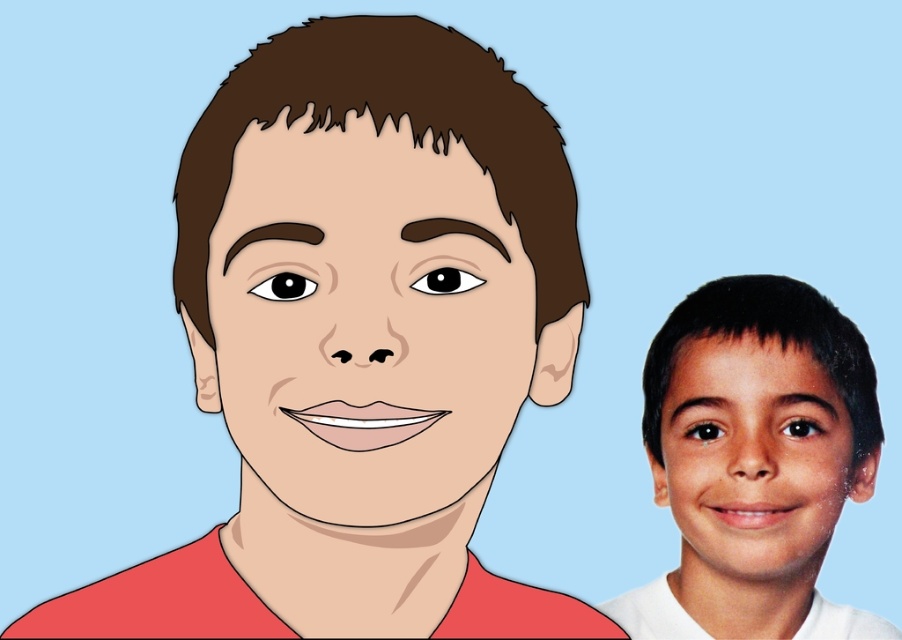
Is point (321, 234) farther from camera compared to point (728, 627)?

No.

Is smooth skin face at center to the left of smooth skin child at right from the viewer's perspective?

Correct, you'll find smooth skin face at center to the left of smooth skin child at right.

Does point (458, 182) lie in front of point (634, 589)?

Yes, it is.

Locate an element on the screen. smooth skin face at center is located at coordinates (364, 317).

Who is higher up, matte red shirt at center or smooth skin face at center?

smooth skin face at center

Which of these two, matte red shirt at center or smooth skin face at center, stands shorter?

With less height is smooth skin face at center.

Measure the distance between point (254,323) and camera.

They are 15.47 inches apart.

At what (x,y) coordinates should I click in order to perform the action: click on matte red shirt at center. Please return your answer as a coordinate pair (x, y). The width and height of the screenshot is (902, 640). Looking at the image, I should click on (361, 340).

Describe the element at coordinates (361, 340) in the screenshot. I see `matte red shirt at center` at that location.

Is matte red shirt at center above smooth skin child at right?

Yes, matte red shirt at center is above smooth skin child at right.

The width and height of the screenshot is (902, 640). What do you see at coordinates (361, 340) in the screenshot?
I see `matte red shirt at center` at bounding box center [361, 340].

Where is `matte red shirt at center`? The image size is (902, 640). matte red shirt at center is located at coordinates (361, 340).